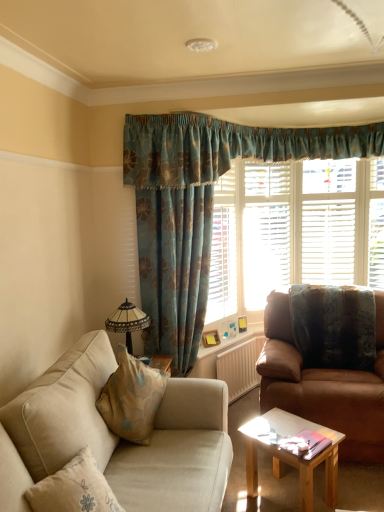
Question: Considering the relative sizes of light brown wooden coffee table at center and textured brown pillow at right in the image provided, is light brown wooden coffee table at center shorter than textured brown pillow at right?

Choices:
 (A) yes
 (B) no

Answer: (A)

Question: Is the depth of light brown wooden coffee table at center less than that of textured brown pillow at right?

Choices:
 (A) no
 (B) yes

Answer: (B)

Question: Are light brown wooden coffee table at center and textured brown pillow at right far apart?

Choices:
 (A) yes
 (B) no

Answer: (B)

Question: Is light brown wooden coffee table at center outside of textured brown pillow at right?

Choices:
 (A) yes
 (B) no

Answer: (A)

Question: Considering the relative positions of light brown wooden coffee table at center and textured brown pillow at right in the image provided, is light brown wooden coffee table at center behind textured brown pillow at right?

Choices:
 (A) no
 (B) yes

Answer: (A)

Question: Is light brown wooden coffee table at center looking in the opposite direction of textured brown pillow at right?

Choices:
 (A) yes
 (B) no

Answer: (B)

Question: Does white textured radiator at center have a greater height compared to beige fabric couch at lower left, the 2th studio couch positioned from the right?

Choices:
 (A) no
 (B) yes

Answer: (A)

Question: Is white textured radiator at center next to beige fabric couch at lower left, which is counted as the first studio couch, starting from the left?

Choices:
 (A) no
 (B) yes

Answer: (A)

Question: Can you confirm if white textured radiator at center is smaller than beige fabric couch at lower left, which ranks as the second studio couch in back-to-front order?

Choices:
 (A) no
 (B) yes

Answer: (B)

Question: Is white textured radiator at center far away from beige fabric couch at lower left, which is counted as the first studio couch, starting from the left?

Choices:
 (A) no
 (B) yes

Answer: (B)

Question: From the image's perspective, is white textured radiator at center located above beige fabric couch at lower left, which is counted as the first studio couch, starting from the left?

Choices:
 (A) no
 (B) yes

Answer: (A)

Question: Does white textured radiator at center appear on the left side of beige fabric couch at lower left, which is the first studio couch in front-to-back order?

Choices:
 (A) no
 (B) yes

Answer: (A)

Question: Considering the relative sizes of brown leather couch at right, arranged as the 1th studio couch when viewed from the back, and textured brown pillow at right in the image provided, is brown leather couch at right, arranged as the 1th studio couch when viewed from the back, taller than textured brown pillow at right?

Choices:
 (A) no
 (B) yes

Answer: (B)